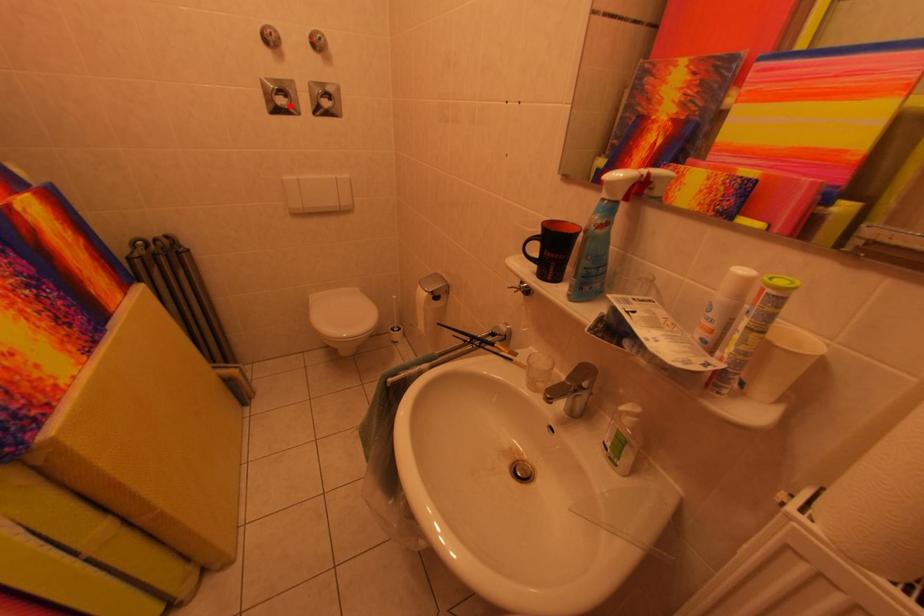
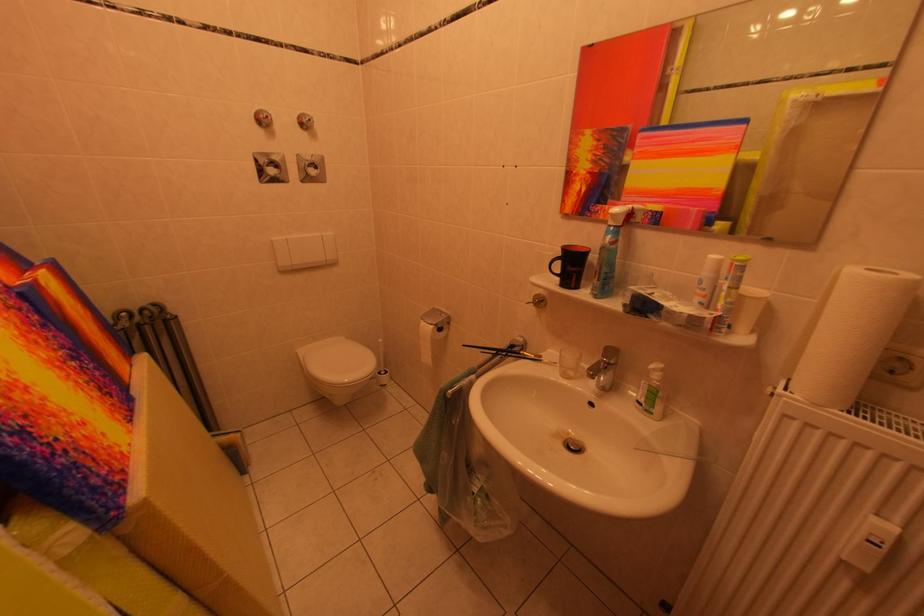
The point at the highlighted location is marked in the first image. Where is the corresponding point in the second image?

(282, 175)